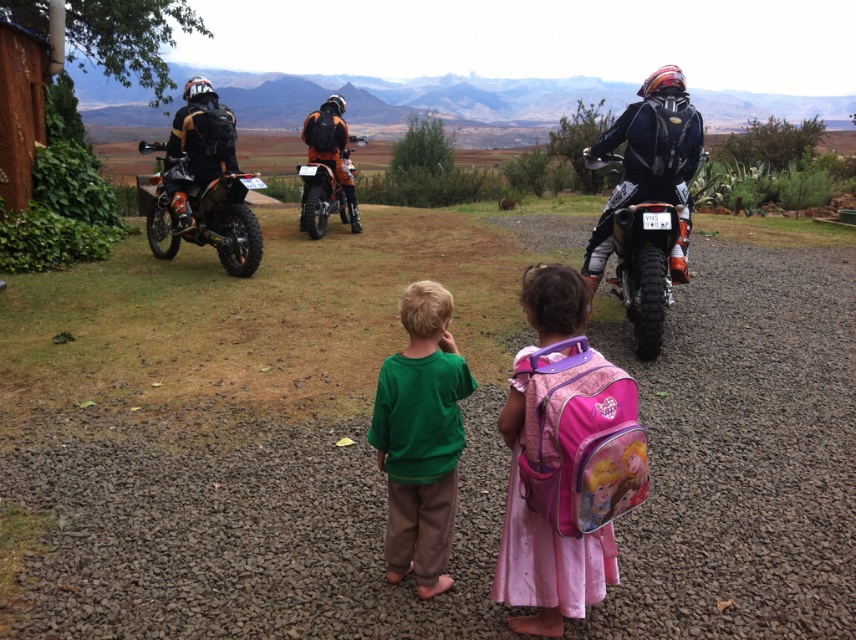
You are standing at the point labeled as point (250,429) in the image. What is the surface you are currently standing on?

The point (250,429) corresponds to the brown gravel dirt track at center, so you are standing on the brown gravel dirt track at center.

You are a hiker who wants to take a photo of the orange matte motorcycle at center and the brown gravel dirt track at center. Which object should you focus on first if you want to capture both in a single shot without moving your camera?

The orange matte motorcycle at center is to the left of the brown gravel dirt track at center, so you should focus on the orange matte motorcycle at center first to ensure both are in frame.